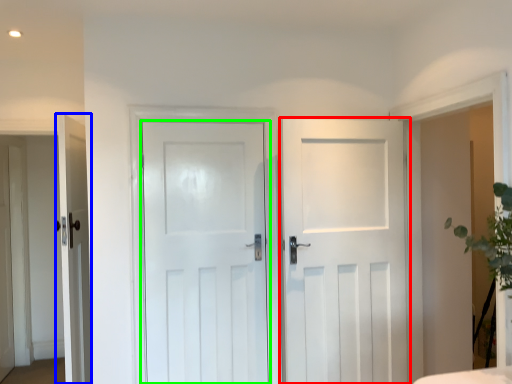
Question: Which object is the farthest from door (highlighted by a red box)? Choose among these: door (highlighted by a blue box) or door (highlighted by a green box).

Choices:
 (A) door
 (B) door

Answer: (A)